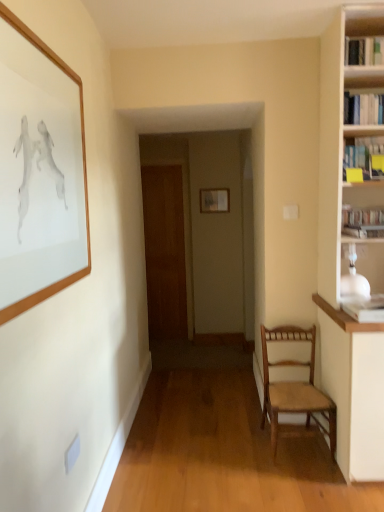
Find the location of a particular element. free space on the front side of wooden woven seat chair at lower right is located at coordinates (312, 484).